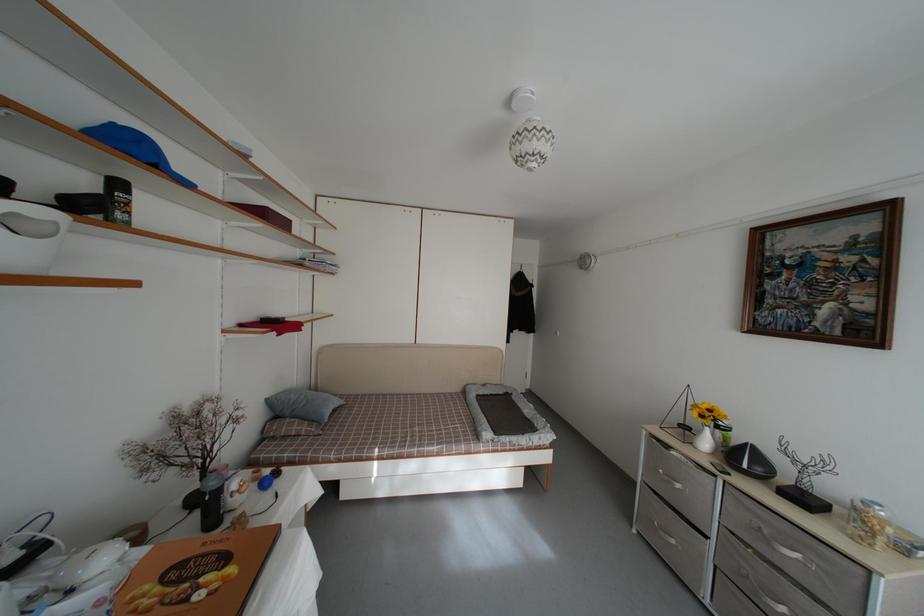
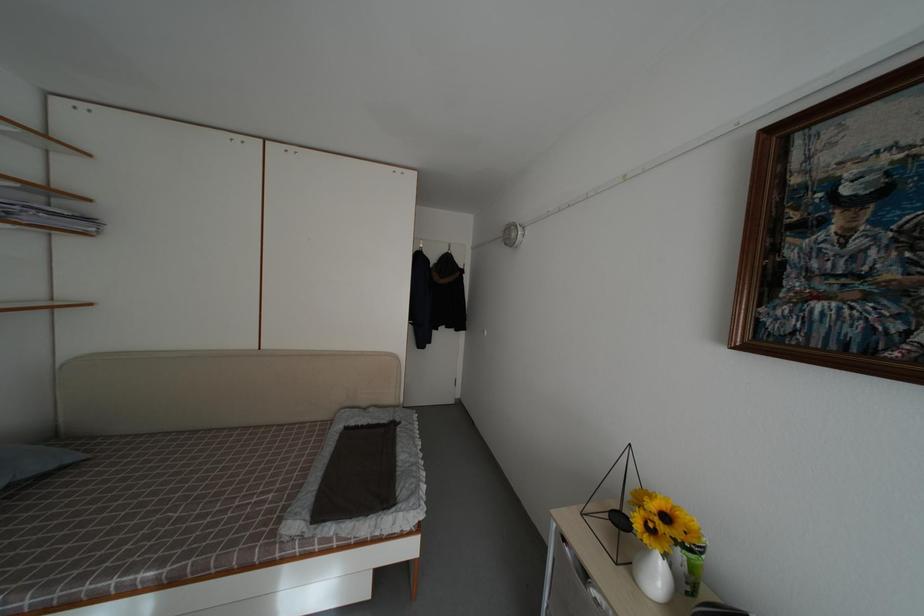
In the second image, find the point that corresponds to point 342,408 in the first image.

(50, 469)